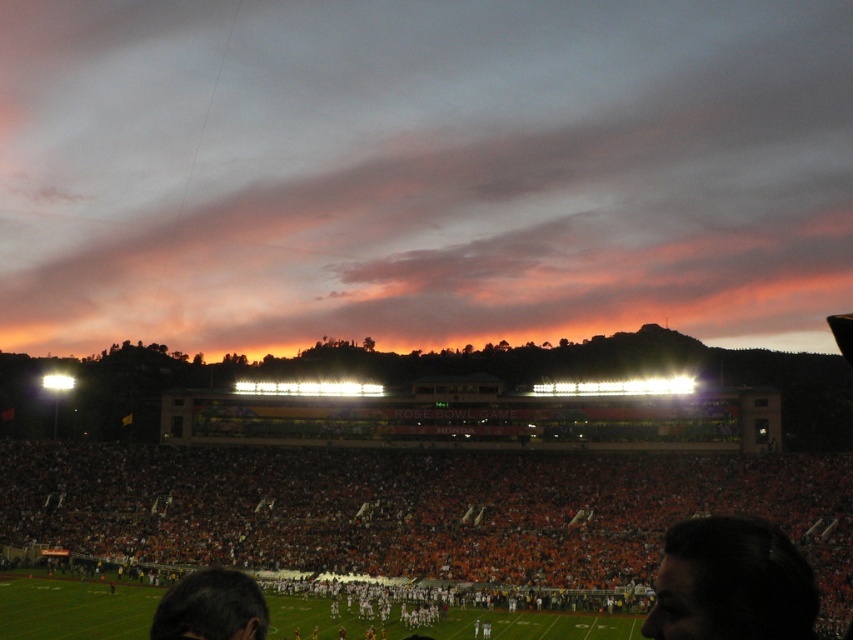
Question: Which object is closer to the camera taking this photo?

Choices:
 (A) orange fabric crowd at lower center
 (B) dark hair at lower left

Answer: (B)

Question: Does orange fabric crowd at lower center have a smaller size compared to dark hair at lower left?

Choices:
 (A) yes
 (B) no

Answer: (B)

Question: Is orange fabric crowd at lower center closer to the viewer compared to dark hair at lower right?

Choices:
 (A) yes
 (B) no

Answer: (B)

Question: Which object appears farthest from the camera in this image?

Choices:
 (A) dark hair at lower left
 (B) dark hair at lower right

Answer: (A)

Question: Among these objects, which one is nearest to the camera?

Choices:
 (A) dark hair at lower left
 (B) orange fabric crowd at lower center
 (C) dark hair at lower right

Answer: (C)

Question: Does orange fabric crowd at lower center appear on the right side of dark hair at lower left?

Choices:
 (A) no
 (B) yes

Answer: (A)